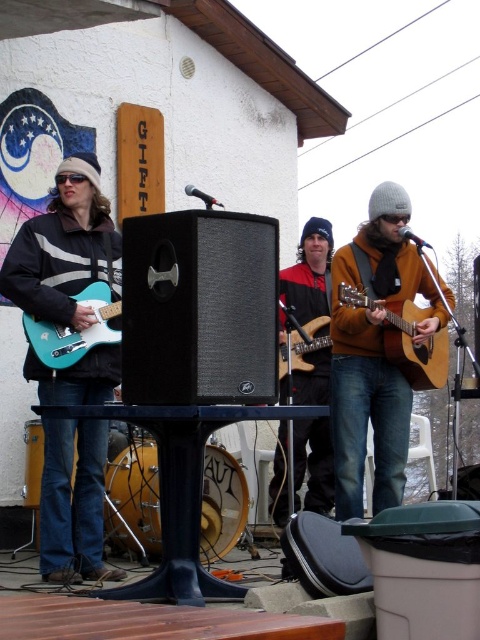
Question: Which point is closer to the camera taking this photo?

Choices:
 (A) (99, 189)
 (B) (67, 340)
 (C) (317, 333)

Answer: (B)

Question: Is the position of teal glossy electric guitar at left more distant than that of wooden acoustic guitar at center?

Choices:
 (A) yes
 (B) no

Answer: (B)

Question: Is reddish-brown leather guitar at center wider than wooden acoustic guitar at center?

Choices:
 (A) no
 (B) yes

Answer: (A)

Question: Among these objects, which one is farthest from the camera?

Choices:
 (A) teal glossy electric guitar at left
 (B) matte black guitar at left
 (C) acoustic wood guitar at center
 (D) wooden acoustic guitar at center

Answer: (D)

Question: Which is farther from the wooden acoustic guitar at center?

Choices:
 (A) reddish-brown leather guitar at center
 (B) matte black guitar at left

Answer: (B)

Question: Is matte black guitar at left below reddish-brown leather guitar at center?

Choices:
 (A) no
 (B) yes

Answer: (A)